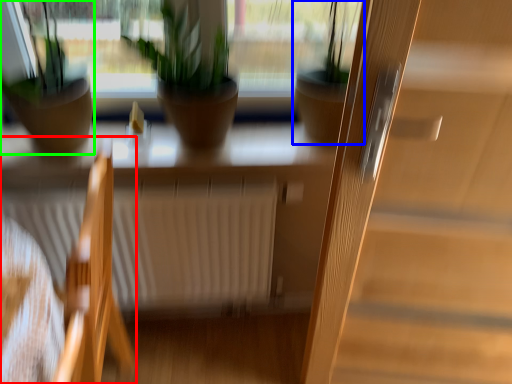
Question: Which object is positioned farthest from chair (highlighted by a red box)? Select from houseplant (highlighted by a blue box) and houseplant (highlighted by a green box).

Choices:
 (A) houseplant
 (B) houseplant

Answer: (A)